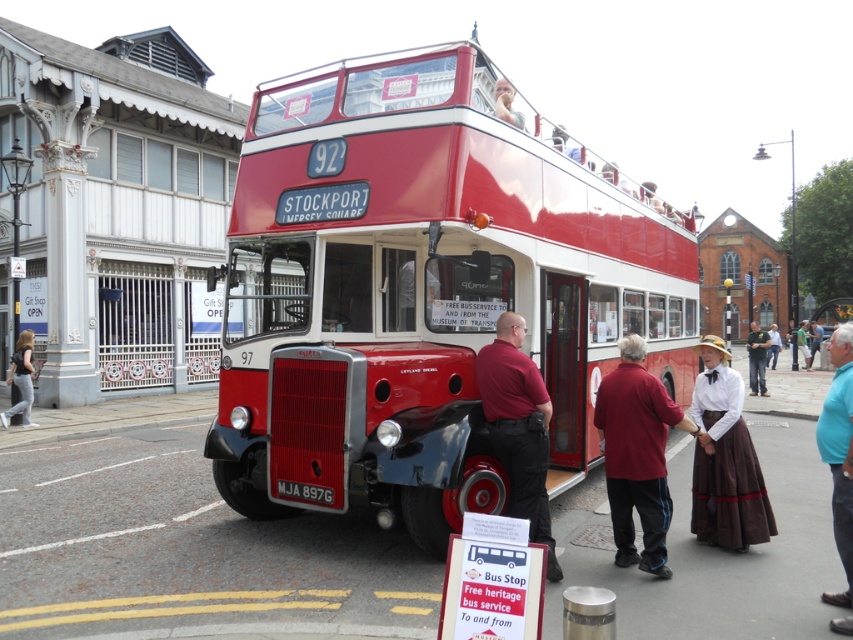
Question: Which point appears closest to the camera in this image?

Choices:
 (A) (286, 483)
 (B) (367, 90)
 (C) (750, 381)
 (D) (843, 556)

Answer: (D)

Question: Which object is closer to the camera taking this photo?

Choices:
 (A) red cotton shirt at center
 (B) black plastic license plate at center
 (C) light blue shirt at center
 (D) brown leather jacket at center

Answer: (A)

Question: Can you confirm if light brown hair at lower left is bigger than smooth skin face at upper center?

Choices:
 (A) yes
 (B) no

Answer: (A)

Question: Does shiny red bus at center appear on the right side of light brown hair at lower left?

Choices:
 (A) yes
 (B) no

Answer: (A)

Question: Is red shirt at center below light brown hair at lower left?

Choices:
 (A) no
 (B) yes

Answer: (A)

Question: Among these objects, which one is nearest to the camera?

Choices:
 (A) light blue shirt at center
 (B) smooth skin face at upper center
 (C) red cotton shirt at center

Answer: (C)